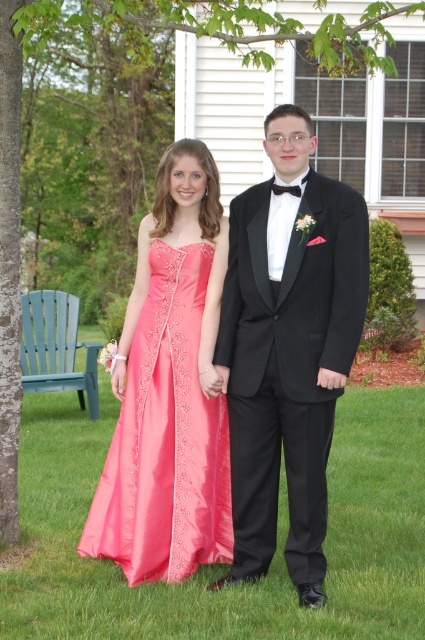
You are a photographer setting up for an outdoor event. You need to ensure that the green grass at center and the shiny pink satin dress at center are both visible in the frame. Based on their heights, which object will appear taller in the photo?

The shiny pink satin dress at center will appear taller in the photo because it is taller than the green grass at center.

You are a photographer at a wedding event. You see the green grass at center and the black satin tuxedo at center. Which object is positioned to the left of the other?

The green grass at center is to the left of the black satin tuxedo at center.

You are standing at point (337, 611) and want to walk towards the white house with the grid window. Is there enough space between the two people holding hands to pass through?

The two people holding hands are 3.68 meters apart, so yes, there is enough space to pass through between them as the distance is sufficient for a person to walk through.